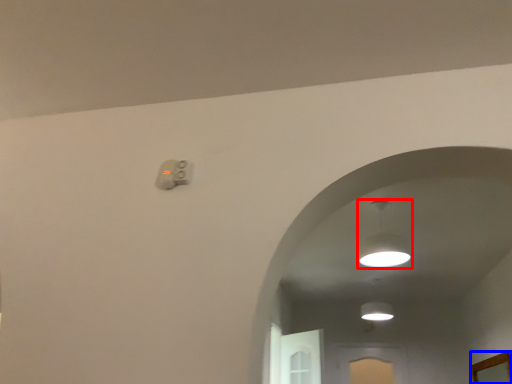
Question: Which object appears closest to the camera in this image, lamp (highlighted by a red box) or mirror (highlighted by a blue box)?

Choices:
 (A) lamp
 (B) mirror

Answer: (A)